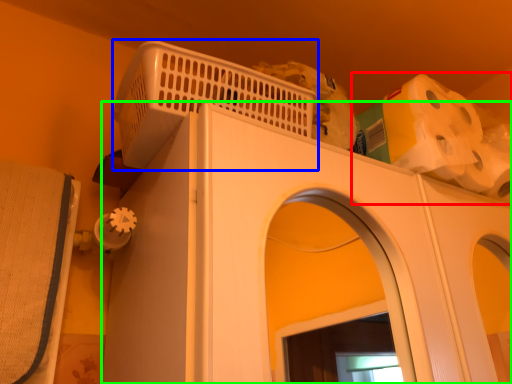
Question: Estimate the real-world distances between objects in this image. Which object is closer to toilet paper (highlighted by a red box), basket (highlighted by a blue box) or home appliance (highlighted by a green box)?

Choices:
 (A) basket
 (B) home appliance

Answer: (B)